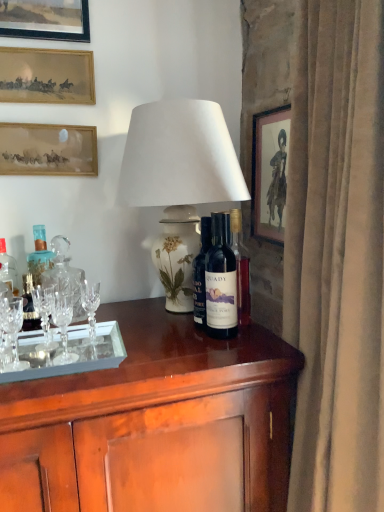
Find the location of a particular element. Image resolution: width=384 pixels, height=512 pixels. spots to the right of clear crystal wine glass at left is located at coordinates (75, 351).